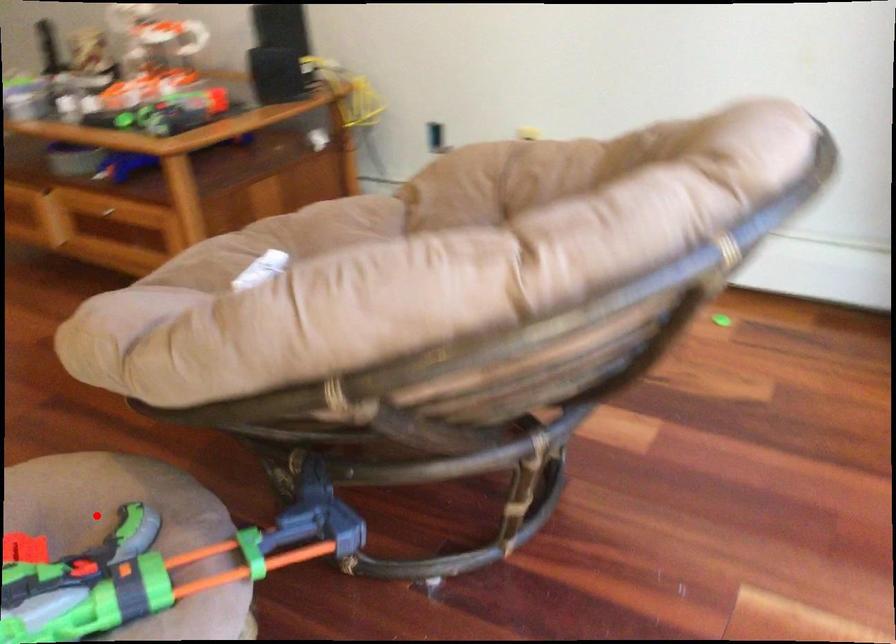
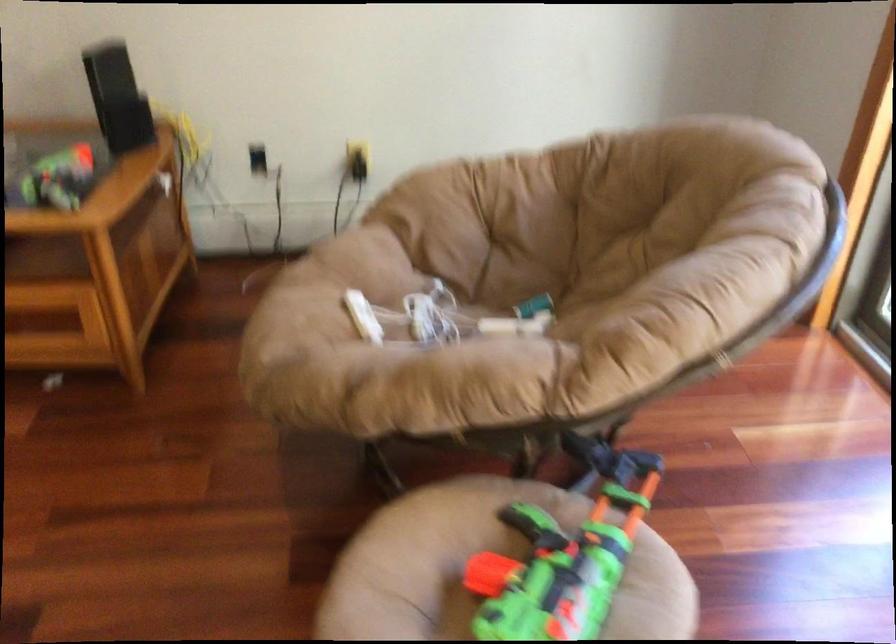
Question: I am providing you with two images of the same scene from different viewpoints. In image1, a red point is highlighted. Considering the same 3D point in image2, which of the following is correct?

Choices:
 (A) It is closer
 (B) It is farther

Answer: (B)